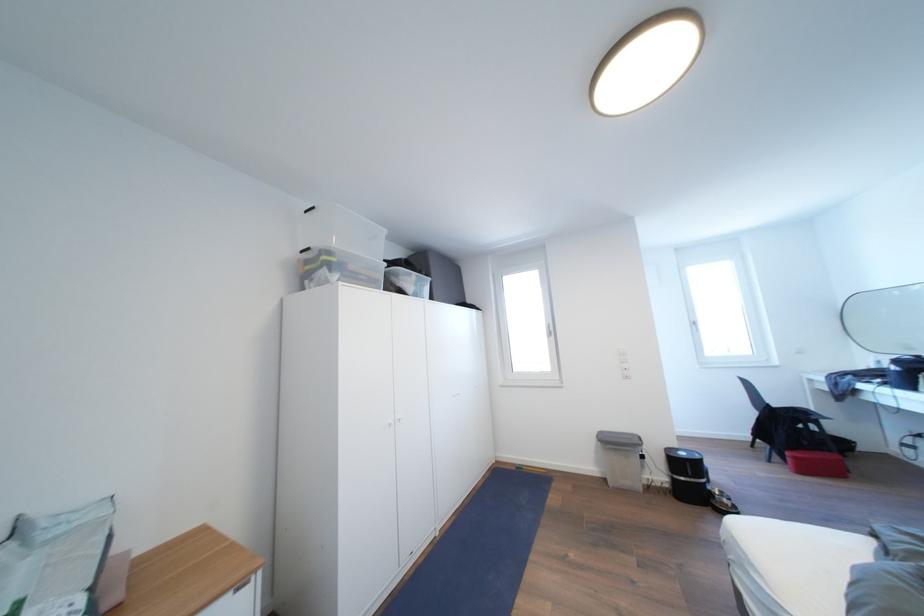
Describe the element at coordinates (687, 476) in the screenshot. I see `the black cylindrical appliance` at that location.